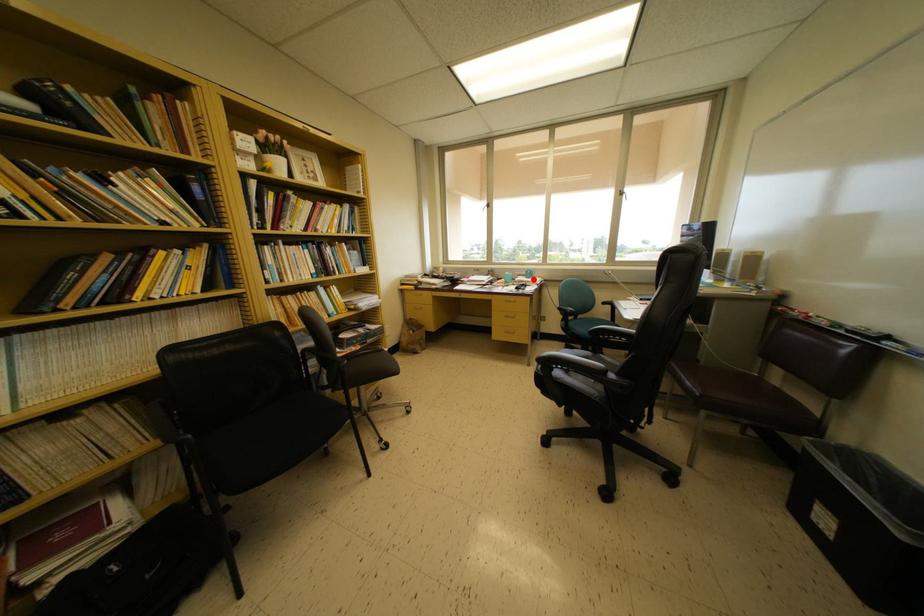
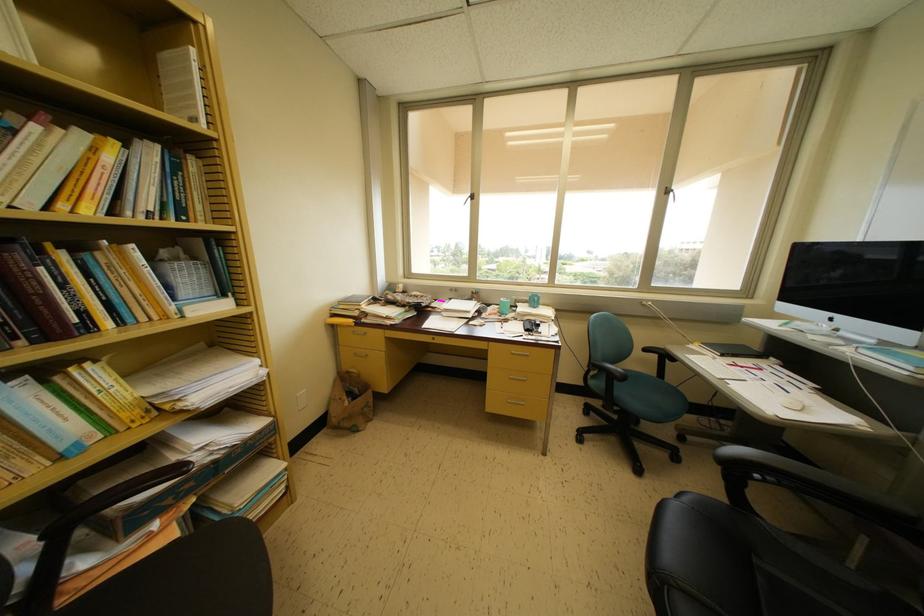
Where in the second image is the point corresponding to the highlighted location from the first image?

(538, 306)